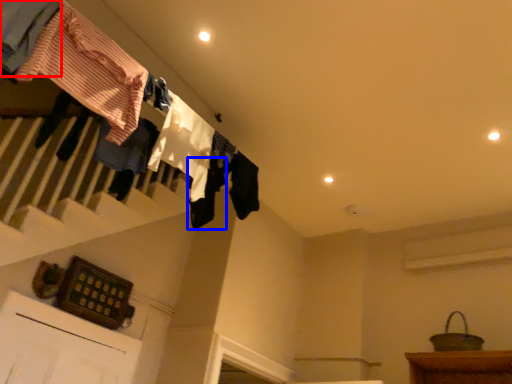
Question: Which of the following is the farthest to the observer, clothing (highlighted by a red box) or clothing (highlighted by a blue box)?

Choices:
 (A) clothing
 (B) clothing

Answer: (B)